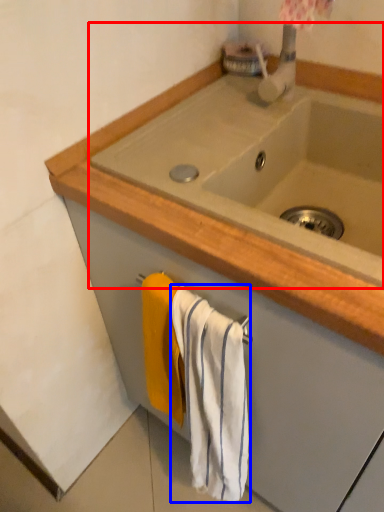
Question: Which point is further to the camera, sink (highlighted by a red box) or bath towel (highlighted by a blue box)?

Choices:
 (A) sink
 (B) bath towel

Answer: (B)